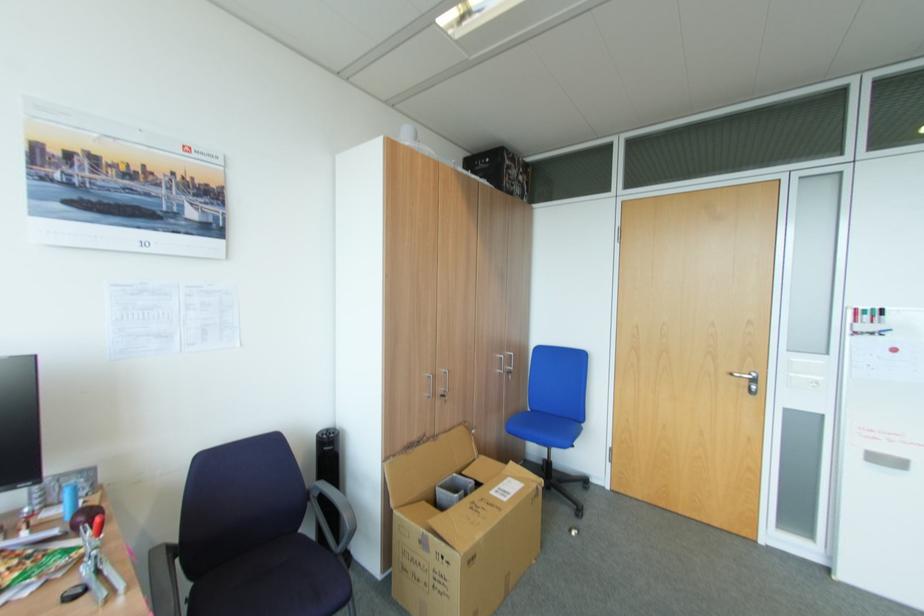
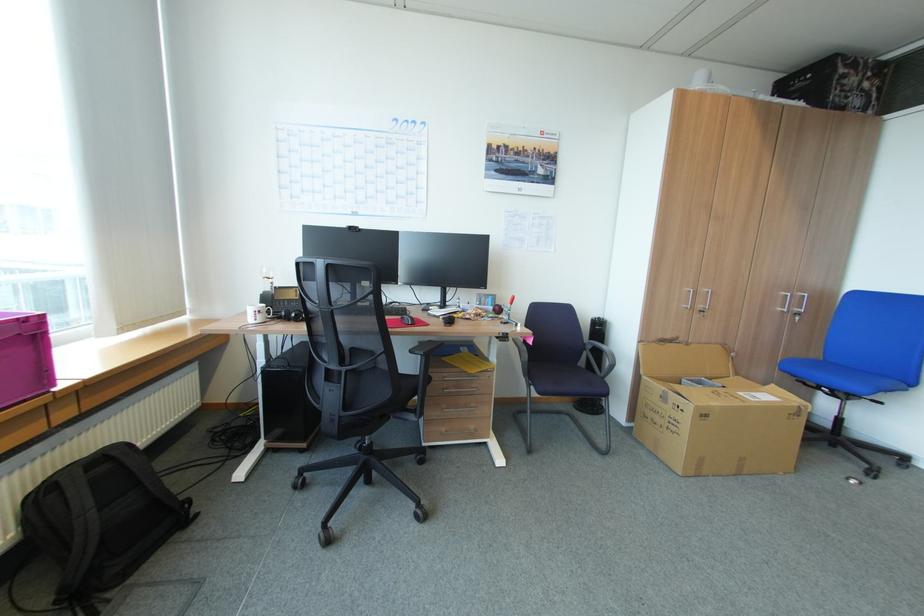
The point at (x=512, y=461) is marked in the first image. Where is the corresponding point in the second image?

(771, 384)